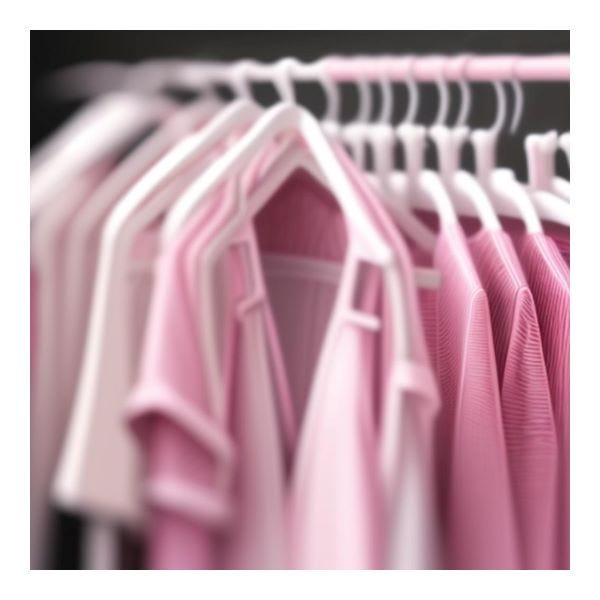
Find the location of a particular element. The width and height of the screenshot is (600, 600). hangers is located at coordinates (240, 89), (203, 96), (285, 101), (330, 109), (358, 126), (386, 128), (414, 132), (453, 134), (487, 139).